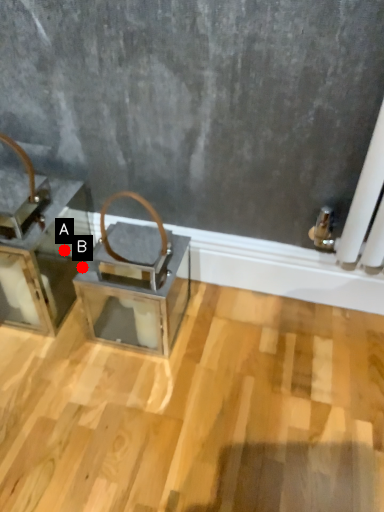
Question: Two points are circled on the image, labeled by A and B beside each circle. Which point is closer to the camera?

Choices:
 (A) A is closer
 (B) B is closer

Answer: (B)